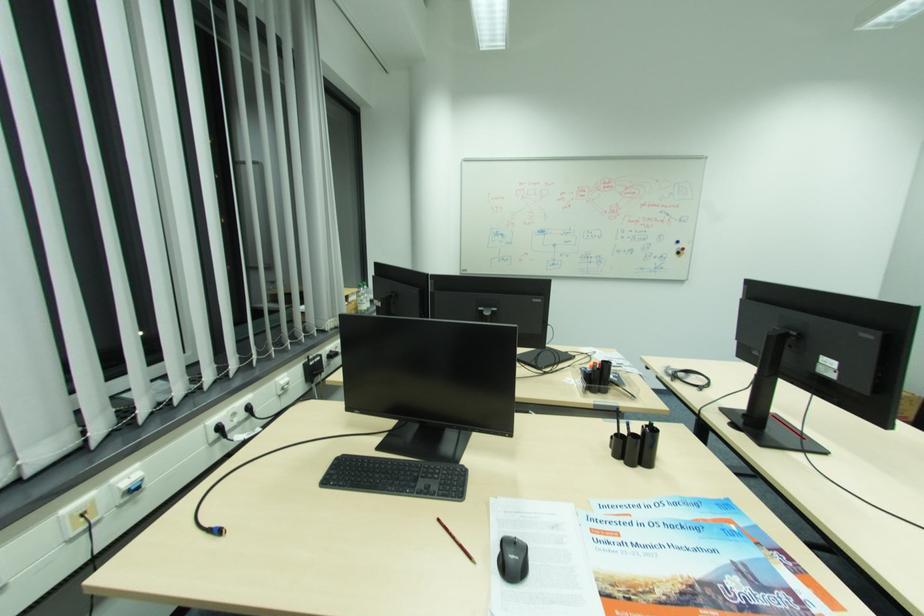
Which object does [679,246] point to?

This point indicates the blue whiteboard marker.